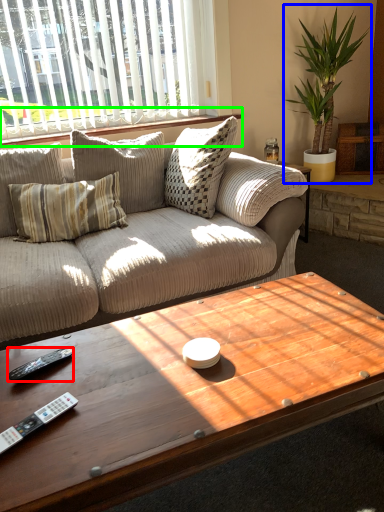
Question: Considering the real-world distances, which object is farthest from remote (highlighted by a red box)? houseplant (highlighted by a blue box) or window sill (highlighted by a green box)?

Choices:
 (A) houseplant
 (B) window sill

Answer: (A)